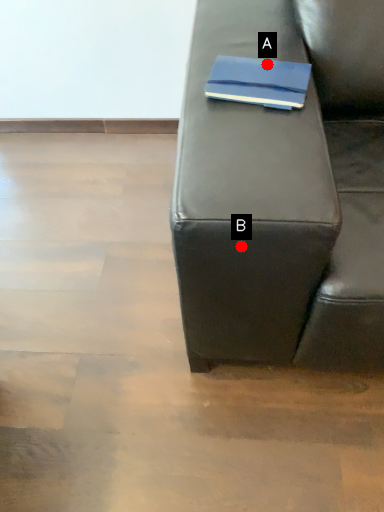
Question: Two points are circled on the image, labeled by A and B beside each circle. Which point is closer to the camera?

Choices:
 (A) A is closer
 (B) B is closer

Answer: (B)